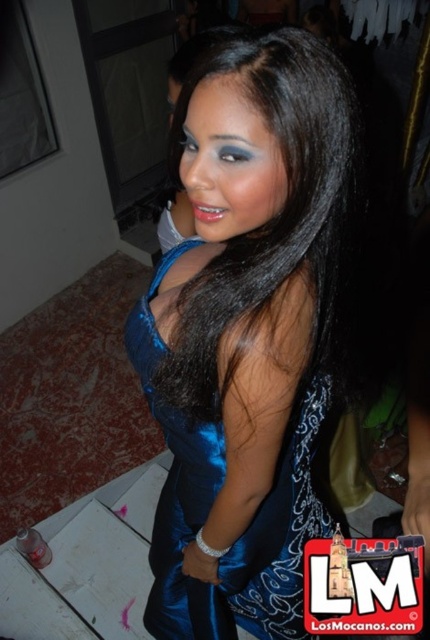
You are a photographer at a fashion show and need to adjust the lighting to ensure both the satin black hair at center and the satin blue dress at center are evenly illuminated. Given their distance apart, can you estimate if the lighting setup will require adjustment to avoid shadows between them?

The satin black hair at center and satin blue dress at center are 11.22 inches apart. Since they are relatively close, the lighting setup should not require major adjustments to ensure even illumination between them, provided the light source is positioned to cover both areas adequately.